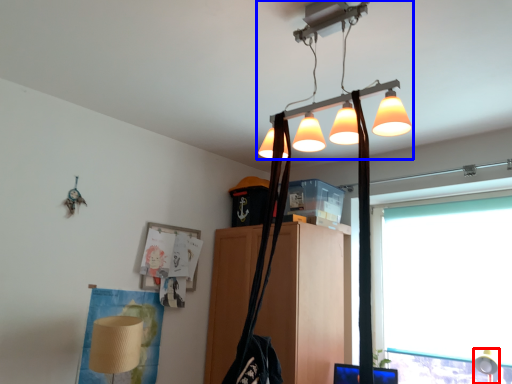
Question: Which object is closer to the camera taking this photo, table lamp (highlighted by a red box) or lamp (highlighted by a blue box)?

Choices:
 (A) table lamp
 (B) lamp

Answer: (B)